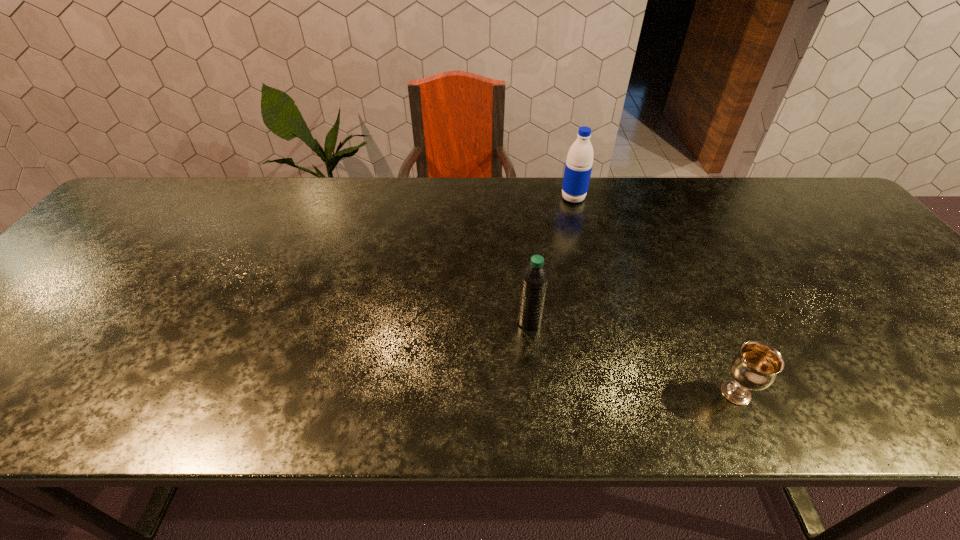
This screenshot has width=960, height=540. Identify the location of vacant region between the farthest object and the nearer water bottle. (552, 260).

You are a GUI agent. You are given a task and a screenshot of the screen. Output one action in this format:
    pyautogui.click(x=<x>, y=<y>)
    Task: Click on the free space between the leftmost object and the second object from right to left
    The height and width of the screenshot is (540, 960).
    Given the screenshot: What is the action you would take?
    pyautogui.click(x=552, y=260)

The image size is (960, 540). In order to click on vacant area that lies between the nearer water bottle and the rightmost object in this screenshot , I will do `click(633, 357)`.

Image resolution: width=960 pixels, height=540 pixels. What are the coordinates of `vacant area that lies between the shortest object and the second object from right to left` in the screenshot? It's located at (655, 295).

Locate an element on the screen. The width and height of the screenshot is (960, 540). free space between the nearer water bottle and the farthest object is located at coordinates (552, 260).

Locate an element on the screen. the second closest object to the farther water bottle is located at coordinates (755, 367).

Choose which object is the nearest neighbor to the left water bottle. Please provide its 2D coordinates. Your answer should be formatted as a tuple, i.e. [(x, y)], where the tuple contains the x and y coordinates of a point satisfying the conditions above.

[(755, 367)]

Identify the location of blank space that satisfies the following two spatial constraints: 1. on the back side of the farthest object; 2. on the left side of the left water bottle. (517, 198).

Where is `vacant space that satisfies the following two spatial constraints: 1. on the front side of the left water bottle; 2. on the left side of the shortest object`? The width and height of the screenshot is (960, 540). vacant space that satisfies the following two spatial constraints: 1. on the front side of the left water bottle; 2. on the left side of the shortest object is located at coordinates (538, 393).

At what (x,y) coordinates should I click in order to perform the action: click on free location that satisfies the following two spatial constraints: 1. on the front side of the rightmost object; 2. on the right side of the left water bottle. Please return your answer as a coordinate pair (x, y). The height and width of the screenshot is (540, 960). Looking at the image, I should click on (538, 393).